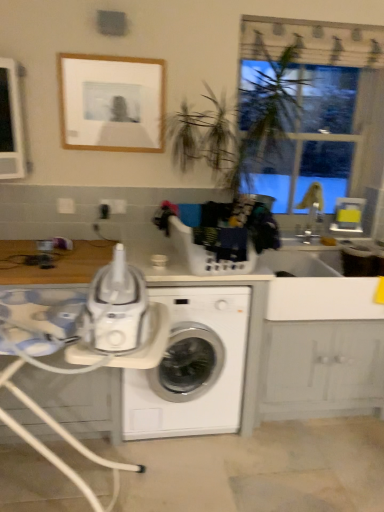
Question: Is white glossy washing machine at center inside white plastic tray at center?

Choices:
 (A) yes
 (B) no

Answer: (A)

Question: Is white plastic tray at center at the right side of white glossy washing machine at center?

Choices:
 (A) no
 (B) yes

Answer: (A)

Question: Does white plastic tray at center have a larger size compared to white glossy washing machine at center?

Choices:
 (A) yes
 (B) no

Answer: (A)

Question: Is white plastic tray at center far away from white glossy washing machine at center?

Choices:
 (A) no
 (B) yes

Answer: (A)

Question: From the image's perspective, would you say white plastic tray at center is positioned over white glossy washing machine at center?

Choices:
 (A) no
 (B) yes

Answer: (B)

Question: Looking at the image, does wooden frame at upper center seem bigger or smaller compared to white plastic tray at center?

Choices:
 (A) big
 (B) small

Answer: (B)

Question: Do you think wooden frame at upper center is within white plastic tray at center, or outside of it?

Choices:
 (A) inside
 (B) outside

Answer: (B)

Question: From a real-world perspective, is wooden frame at upper center positioned above or below white plastic tray at center?

Choices:
 (A) above
 (B) below

Answer: (A)

Question: Considering the positions of wooden frame at upper center and white plastic tray at center in the image, is wooden frame at upper center taller or shorter than white plastic tray at center?

Choices:
 (A) short
 (B) tall

Answer: (A)

Question: Is wooden frame at upper center inside the boundaries of white glossy washing machine at center, or outside?

Choices:
 (A) outside
 (B) inside

Answer: (A)

Question: From a real-world perspective, is wooden frame at upper center positioned above or below white glossy washing machine at center?

Choices:
 (A) above
 (B) below

Answer: (A)

Question: In terms of height, does wooden frame at upper center look taller or shorter compared to white glossy washing machine at center?

Choices:
 (A) tall
 (B) short

Answer: (B)

Question: Relative to white glossy washing machine at center, is wooden frame at upper center in front or behind?

Choices:
 (A) front
 (B) behind

Answer: (B)

Question: From a real-world perspective, is white plastic tray at center physically located above or below white glossy washing machine at center?

Choices:
 (A) below
 (B) above

Answer: (B)

Question: Considering their positions, is white plastic tray at center located in front of or behind white glossy washing machine at center?

Choices:
 (A) front
 (B) behind

Answer: (A)